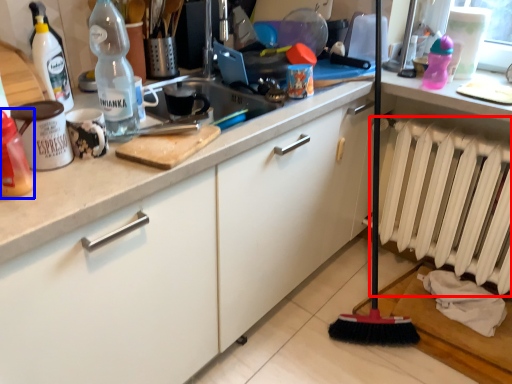
Question: Which object appears closest to the camera in this image, radiator (highlighted by a red box) or bottle (highlighted by a blue box)?

Choices:
 (A) radiator
 (B) bottle

Answer: (B)